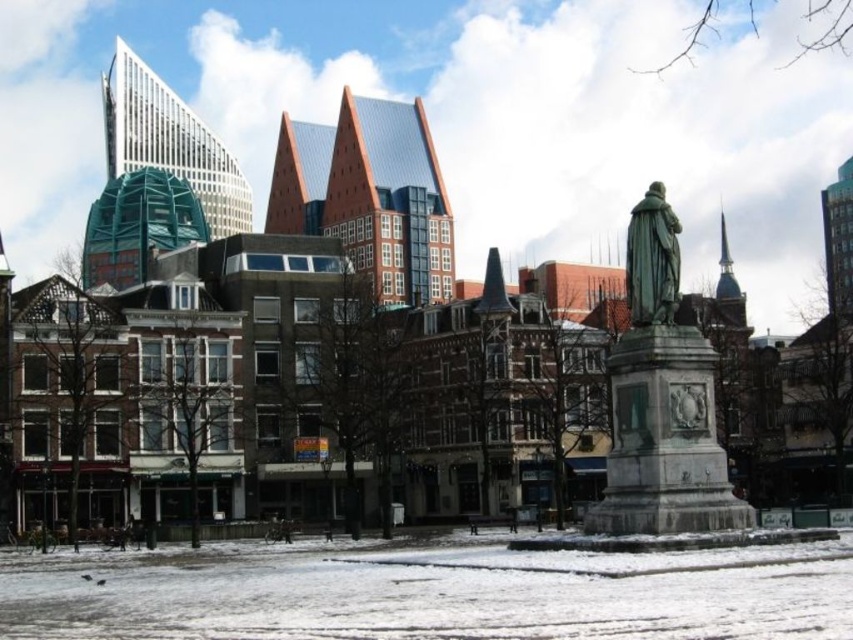
Is bronze statue at center further to the viewer compared to green polished stone statue at center?

No.

Which is more to the right, bronze statue at center or green polished stone statue at center?

Positioned to the right is green polished stone statue at center.

Between point (666, 321) and point (665, 205), which one is positioned behind?

Positioned behind is point (665, 205).

Locate an element on the screen. This screenshot has width=853, height=640. bronze statue at center is located at coordinates (662, 401).

How much distance is there between white powdery snow at lower center and green polished stone statue at center?

white powdery snow at lower center is 18.25 meters away from green polished stone statue at center.

Between point (670, 579) and point (641, 273), which one is positioned behind?

The point (641, 273) is behind.

This screenshot has width=853, height=640. What do you see at coordinates (437, 595) in the screenshot? I see `white powdery snow at lower center` at bounding box center [437, 595].

Identify the location of white powdery snow at lower center. The image size is (853, 640). (437, 595).

The width and height of the screenshot is (853, 640). What do you see at coordinates (437, 595) in the screenshot? I see `white powdery snow at lower center` at bounding box center [437, 595].

Which is more to the left, white powdery snow at lower center or bronze statue at center?

From the viewer's perspective, white powdery snow at lower center appears more on the left side.

The height and width of the screenshot is (640, 853). I want to click on white powdery snow at lower center, so click(x=437, y=595).

Where is `white powdery snow at lower center`? Image resolution: width=853 pixels, height=640 pixels. white powdery snow at lower center is located at coordinates (437, 595).